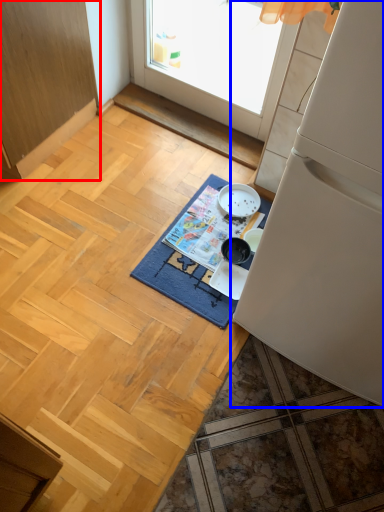
Question: Which object is closer to the camera taking this photo, cabinetry (highlighted by a red box) or refrigerator (highlighted by a blue box)?

Choices:
 (A) cabinetry
 (B) refrigerator

Answer: (B)